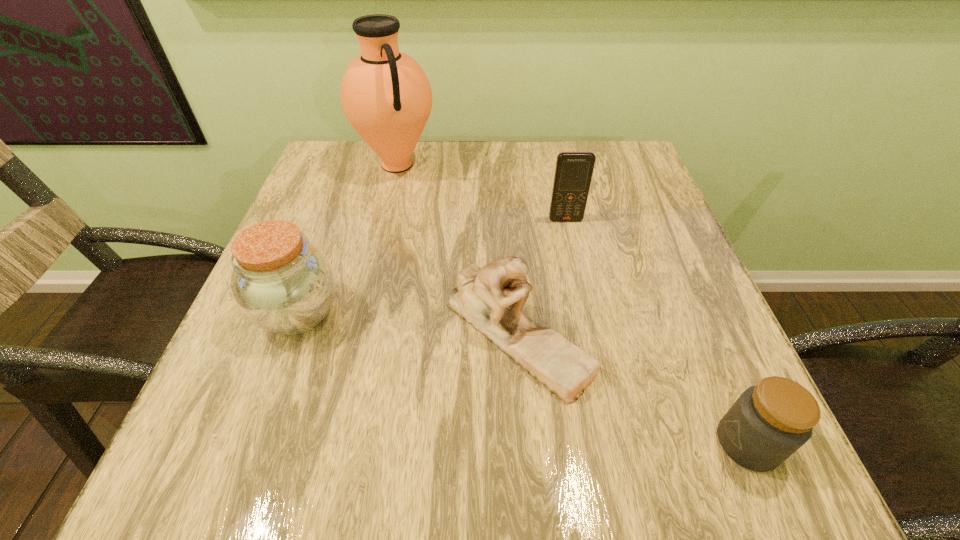
Find the location of `vacant area that lies between the shortest object and the left jar`. vacant area that lies between the shortest object and the left jar is located at coordinates (523, 378).

At what (x,y) coordinates should I click in order to perform the action: click on vacant space that's between the figurine and the shorter jar. Please return your answer as a coordinate pair (x, y). The height and width of the screenshot is (540, 960). Looking at the image, I should click on (633, 388).

Locate an element on the screen. vacant area that lies between the farther jar and the shorter jar is located at coordinates (523, 378).

Where is `blank region between the shorter jar and the cellular telephone`? blank region between the shorter jar and the cellular telephone is located at coordinates (657, 332).

Identify the location of vacant area that lies between the left jar and the shortest object. (523, 378).

Image resolution: width=960 pixels, height=540 pixels. What are the coordinates of `free spot between the figurine and the farthest object` in the screenshot? It's located at point(457,249).

This screenshot has width=960, height=540. I want to click on unoccupied area between the cellular telephone and the left jar, so click(x=432, y=266).

Find the location of a particular element. This screenshot has width=960, height=540. empty location between the farthest object and the second farthest object is located at coordinates (482, 192).

You are a GUI agent. You are given a task and a screenshot of the screen. Output one action in this format:
    pyautogui.click(x=<x>, y=<y>)
    Task: Click on the object that is the closest to the figurine
    The height and width of the screenshot is (540, 960).
    Given the screenshot: What is the action you would take?
    pyautogui.click(x=770, y=421)

Point out which object is positioned as the second nearest to the taller jar. Please provide its 2D coordinates. Your answer should be formatted as a tuple, i.e. [(x, y)], where the tuple contains the x and y coordinates of a point satisfying the conditions above.

[(385, 94)]